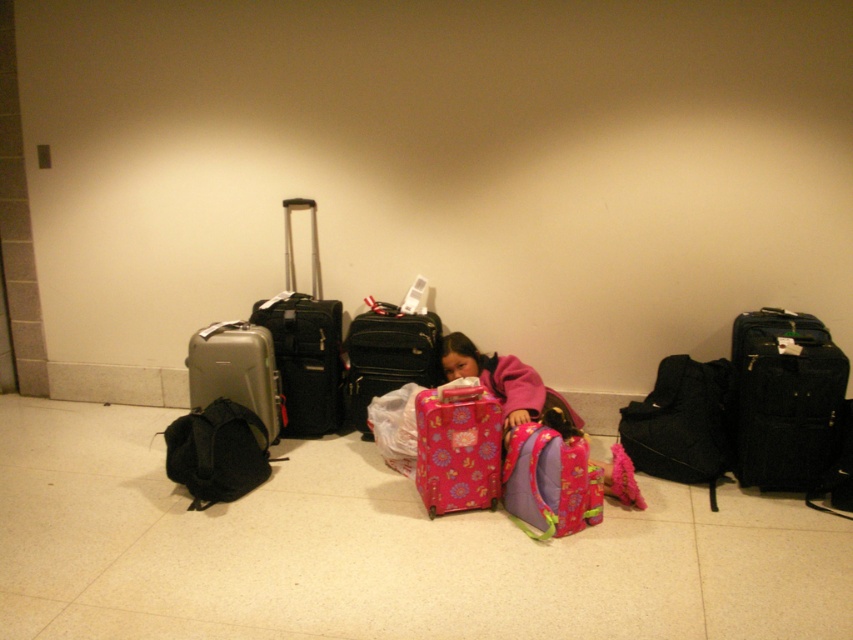
You are standing at the center of the airport terminal and see the point marked at coordinates (218, 452). What object is located at that point?

The point at coordinates (218, 452) indicates the location of the black fabric backpack at left.

You are standing in the airport scene and want to pick up an item. If you move forward, which point among point (437, 330) and point (213, 376) will you reach first?

Point (437, 330) is further to the viewer than point (213, 376), so you will reach point (437, 330) first.

You are a traveler who just arrived at the airport and need to pick up your luggage. You have a pink floral backpack at center and a camera. How far apart are these two items?

The pink floral backpack at center and the camera are 2.56 meters apart from each other.